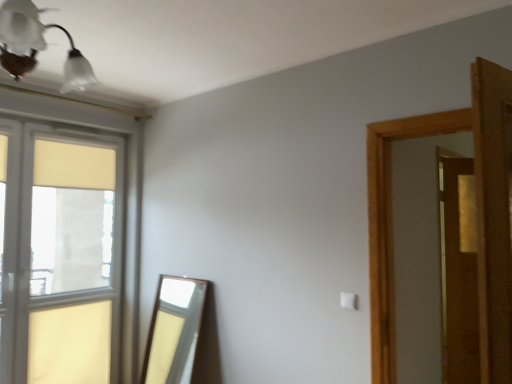
Question: Is wooden door at right wider than matte glass window at left?

Choices:
 (A) yes
 (B) no

Answer: (B)

Question: Is wooden door at right outside of matte glass window at left?

Choices:
 (A) yes
 (B) no

Answer: (A)

Question: Does wooden door at right lie in front of matte glass window at left?

Choices:
 (A) yes
 (B) no

Answer: (A)

Question: Considering the relative sizes of wooden door at right and matte glass window at left in the image provided, is wooden door at right thinner than matte glass window at left?

Choices:
 (A) no
 (B) yes

Answer: (B)

Question: From a real-world perspective, is wooden door at right physically above matte glass window at left?

Choices:
 (A) yes
 (B) no

Answer: (A)

Question: In terms of height, does wooden screen door at right look taller or shorter compared to wooden door at right?

Choices:
 (A) short
 (B) tall

Answer: (B)

Question: Looking at their shapes, would you say wooden screen door at right is wider or thinner than wooden door at right?

Choices:
 (A) wide
 (B) thin

Answer: (B)

Question: From a real-world perspective, relative to wooden door at right, is wooden screen door at right vertically above or below?

Choices:
 (A) below
 (B) above

Answer: (A)

Question: Does point (445, 309) appear closer or farther from the camera than point (373, 213)?

Choices:
 (A) farther
 (B) closer

Answer: (A)

Question: Is point (23, 1) closer or farther from the camera than point (70, 195)?

Choices:
 (A) farther
 (B) closer

Answer: (B)

Question: Is white glass light fixture at upper left inside or outside of matte glass window at left?

Choices:
 (A) outside
 (B) inside

Answer: (A)

Question: Is white glass light fixture at upper left to the left or to the right of matte glass window at left in the image?

Choices:
 (A) left
 (B) right

Answer: (B)

Question: In terms of width, does white glass light fixture at upper left look wider or thinner when compared to matte glass window at left?

Choices:
 (A) thin
 (B) wide

Answer: (B)

Question: Is white glass light fixture at upper left wider or thinner than wooden screen door at right?

Choices:
 (A) wide
 (B) thin

Answer: (A)

Question: From their relative heights in the image, would you say white glass light fixture at upper left is taller or shorter than wooden screen door at right?

Choices:
 (A) tall
 (B) short

Answer: (B)